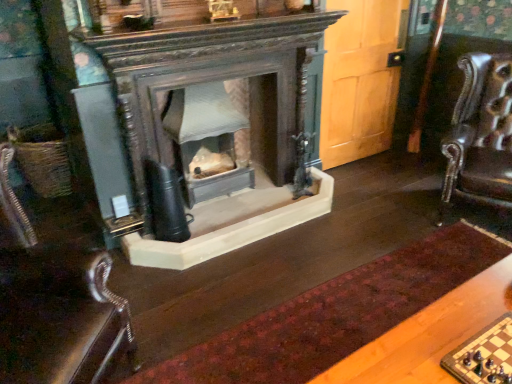
Question: Should I look upward or downward to see wooden chessboard at lower right?

Choices:
 (A) down
 (B) up

Answer: (A)

Question: Is velvet burgundy rug at center with leather at left?

Choices:
 (A) yes
 (B) no

Answer: (B)

Question: Does velvet burgundy rug at center have a lesser height compared to leather at left?

Choices:
 (A) no
 (B) yes

Answer: (B)

Question: Does velvet burgundy rug at center have a lesser width compared to leather at left?

Choices:
 (A) no
 (B) yes

Answer: (B)

Question: From the image's perspective, is velvet burgundy rug at center above leather at left?

Choices:
 (A) yes
 (B) no

Answer: (B)

Question: Is leather at left inside velvet burgundy rug at center?

Choices:
 (A) no
 (B) yes

Answer: (A)

Question: Does velvet burgundy rug at center turn towards leather at left?

Choices:
 (A) yes
 (B) no

Answer: (B)

Question: Considering the relative sizes of leather at left and wooden chessboard at lower right in the image provided, is leather at left wider than wooden chessboard at lower right?

Choices:
 (A) no
 (B) yes

Answer: (B)

Question: Is leather at left at the right side of wooden chessboard at lower right?

Choices:
 (A) no
 (B) yes

Answer: (A)

Question: Is leather at left shorter than wooden chessboard at lower right?

Choices:
 (A) no
 (B) yes

Answer: (A)

Question: Is leather at left looking in the opposite direction of wooden chessboard at lower right?

Choices:
 (A) no
 (B) yes

Answer: (A)

Question: Considering the relative sizes of leather at left and wooden chessboard at lower right in the image provided, is leather at left bigger than wooden chessboard at lower right?

Choices:
 (A) yes
 (B) no

Answer: (A)

Question: Is leather at left outside of wooden chessboard at lower right?

Choices:
 (A) yes
 (B) no

Answer: (A)

Question: From a real-world perspective, is leather at left on velvet burgundy rug at center?

Choices:
 (A) yes
 (B) no

Answer: (A)